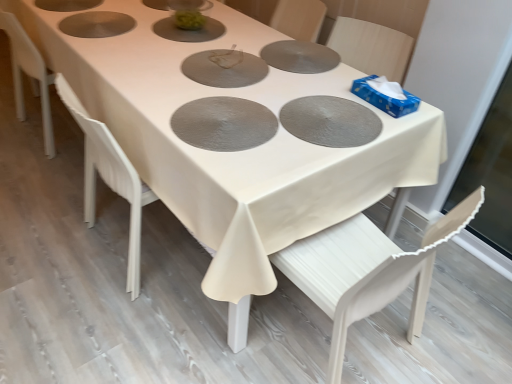
Where is `empty space that is ontop of textured silver pizza pan at center, which is counted as the third pizza pan, starting from the top`? This screenshot has width=512, height=384. empty space that is ontop of textured silver pizza pan at center, which is counted as the third pizza pan, starting from the top is located at coordinates (220, 113).